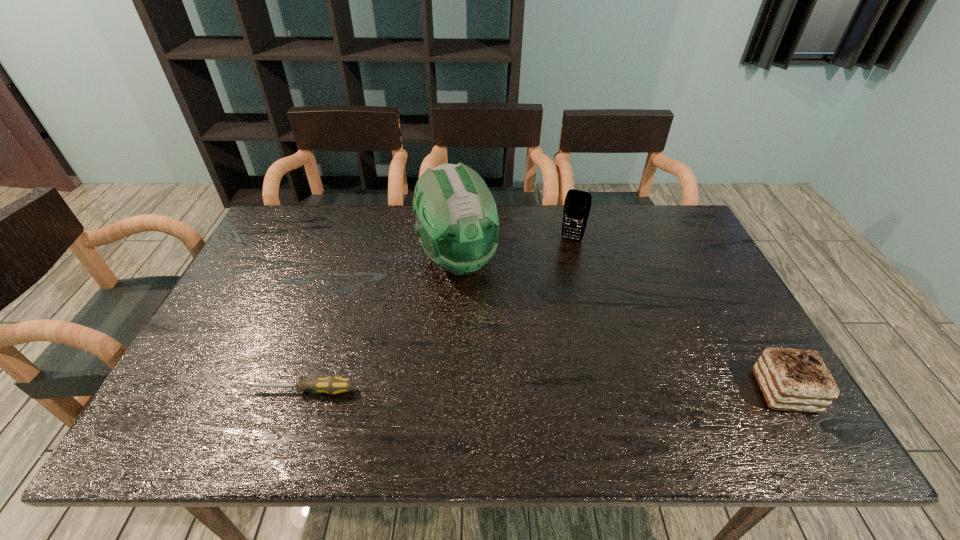
Identify the location of unoccupied position between the third object from left to right and the screwdriver. [x=437, y=315].

Where is `vacant space that is in between the shortest object and the football helmet`? This screenshot has height=540, width=960. vacant space that is in between the shortest object and the football helmet is located at coordinates (380, 325).

Where is `unoccupied area between the second shortest object and the second object from right to left`? unoccupied area between the second shortest object and the second object from right to left is located at coordinates (678, 315).

Find the location of a particular element. This screenshot has width=960, height=540. vacant area that lies between the second shortest object and the screwdriver is located at coordinates (543, 391).

The width and height of the screenshot is (960, 540). In order to click on vacant space that's between the second object from left to right and the second object from right to left in this screenshot , I will do `click(515, 249)`.

At what (x,y) coordinates should I click in order to perform the action: click on free space that is in between the shortest object and the third object from left to right. Please return your answer as a coordinate pair (x, y). The image size is (960, 540). Looking at the image, I should click on (437, 315).

Where is `vacant area between the football helmet and the second tallest object`? The height and width of the screenshot is (540, 960). vacant area between the football helmet and the second tallest object is located at coordinates (515, 249).

Locate an element on the screen. This screenshot has width=960, height=540. free area in between the screwdriver and the rightmost object is located at coordinates (543, 391).

This screenshot has width=960, height=540. Identify the location of free spot between the chocolate cake and the second tallest object. (678, 315).

Locate an element on the screen. vacant area between the leftmost object and the tallest object is located at coordinates (380, 325).